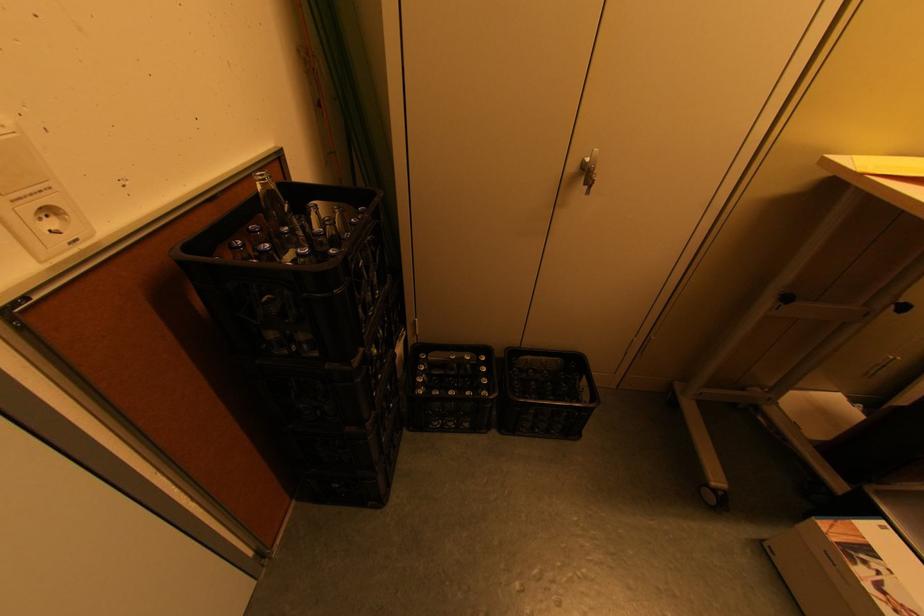
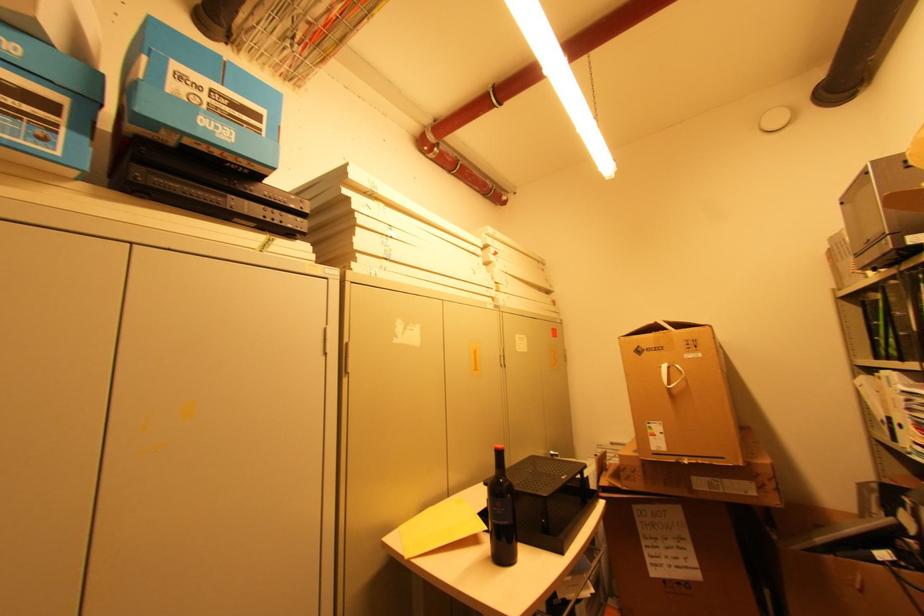
The images are taken continuously from a first-person perspective. In which direction is your viewpoint rotating?

The camera's rotation is toward right-up.